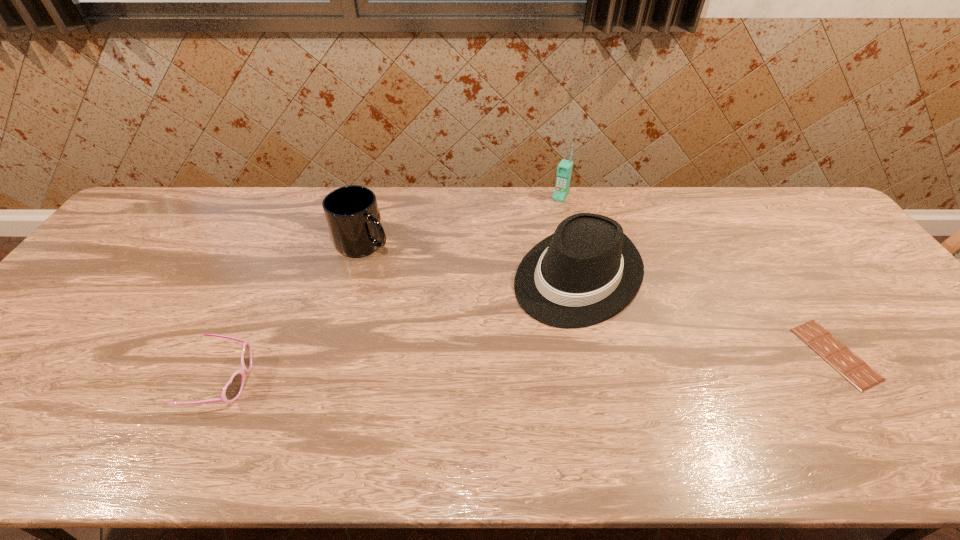
Locate an element on the screen. the leftmost object is located at coordinates (232, 390).

You are a GUI agent. You are given a task and a screenshot of the screen. Output one action in this format:
    pyautogui.click(x=<x>, y=<y>)
    Task: Click on the sunglasses
    
    Given the screenshot: What is the action you would take?
    pyautogui.click(x=232, y=390)

Locate an element on the screen. chocolate bar is located at coordinates (857, 372).

Identify the location of the shortest object. This screenshot has width=960, height=540. (857, 372).

At what (x,y) coordinates should I click in order to perform the action: click on fedora. Please return your answer as a coordinate pair (x, y). Looking at the image, I should click on (588, 270).

The width and height of the screenshot is (960, 540). What are the coordinates of `cellular telephone` in the screenshot? It's located at (564, 169).

The image size is (960, 540). In order to click on the tallest object in this screenshot , I will do `click(564, 169)`.

What are the coordinates of `the fourth object from right to left` in the screenshot? It's located at (352, 214).

At what (x,y) coordinates should I click in order to perform the action: click on free space located on the front-facing side of the second shortest object. Please return your answer as a coordinate pair (x, y). This screenshot has height=540, width=960. Looking at the image, I should click on (360, 381).

Where is `free space located 0.270m on the left of the shortest object`? The image size is (960, 540). free space located 0.270m on the left of the shortest object is located at coordinates (693, 354).